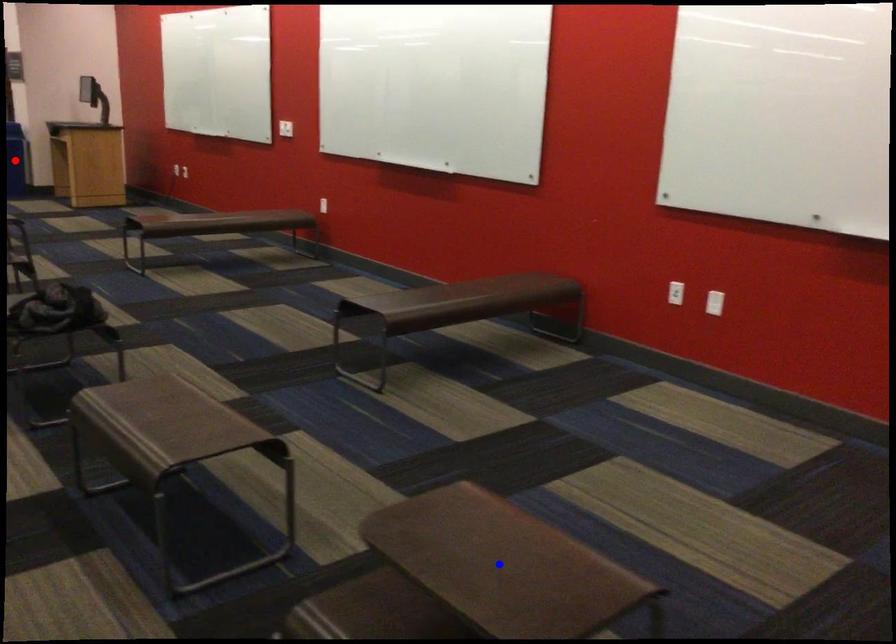
Question: In the image, two points are highlighted. Which point is nearer to the camera? Reply with the corresponding letter.

Choices:
 (A) blue point
 (B) red point

Answer: (A)